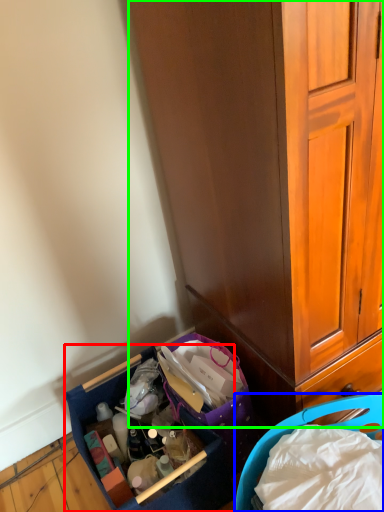
Question: Based on their relative distances, which object is nearer to picnic basket (highlighted by a red box)? Choose from picnic basket (highlighted by a blue box) and cabinetry (highlighted by a green box).

Choices:
 (A) picnic basket
 (B) cabinetry

Answer: (A)